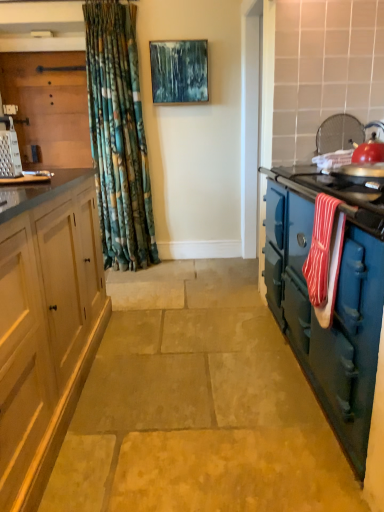
The image size is (384, 512). Find the location of `vacant space situated above textured canvas painting at upper center (from a real-world perspective)`. vacant space situated above textured canvas painting at upper center (from a real-world perspective) is located at coordinates (183, 39).